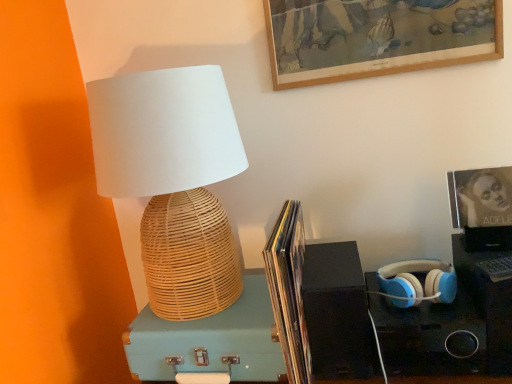
Question: Could you tell me if light blue wicker suitcase at center is facing matte paper book at center?

Choices:
 (A) no
 (B) yes

Answer: (A)

Question: Is light blue wicker suitcase at center at the right side of matte paper book at center?

Choices:
 (A) no
 (B) yes

Answer: (A)

Question: Does light blue wicker suitcase at center lie in front of matte paper book at center?

Choices:
 (A) no
 (B) yes

Answer: (A)

Question: Considering the relative sizes of light blue wicker suitcase at center and matte paper book at center in the image provided, is light blue wicker suitcase at center shorter than matte paper book at center?

Choices:
 (A) yes
 (B) no

Answer: (A)

Question: Is light blue wicker suitcase at center not within matte paper book at center?

Choices:
 (A) yes
 (B) no

Answer: (A)

Question: Considering the relative positions of matte paper book at center and blue matte headphones at right in the image provided, is matte paper book at center to the left or to the right of blue matte headphones at right?

Choices:
 (A) right
 (B) left

Answer: (B)

Question: Which is correct: matte paper book at center is inside blue matte headphones at right, or outside of it?

Choices:
 (A) outside
 (B) inside

Answer: (A)

Question: From a real-world perspective, is matte paper book at center positioned above or below blue matte headphones at right?

Choices:
 (A) below
 (B) above

Answer: (B)

Question: Looking at the image, does matte paper book at center seem bigger or smaller compared to blue matte headphones at right?

Choices:
 (A) big
 (B) small

Answer: (A)

Question: From the image's perspective, is black matte speaker at lower right located above or below blue matte headphones at right?

Choices:
 (A) below
 (B) above

Answer: (A)

Question: Considering the positions of black matte speaker at lower right and blue matte headphones at right in the image, is black matte speaker at lower right taller or shorter than blue matte headphones at right?

Choices:
 (A) tall
 (B) short

Answer: (A)

Question: Do you think black matte speaker at lower right is within blue matte headphones at right, or outside of it?

Choices:
 (A) inside
 (B) outside

Answer: (B)

Question: Is black matte speaker at lower right to the left or to the right of blue matte headphones at right in the image?

Choices:
 (A) left
 (B) right

Answer: (A)

Question: In the image, is matte black album cover at upper right, which ranks as the second picture frame in top-to-bottom order, positioned in front of or behind light blue wicker suitcase at center?

Choices:
 (A) front
 (B) behind

Answer: (B)

Question: Is matte black album cover at upper right, placed as the first picture frame when sorted from bottom to top, bigger or smaller than light blue wicker suitcase at center?

Choices:
 (A) small
 (B) big

Answer: (A)